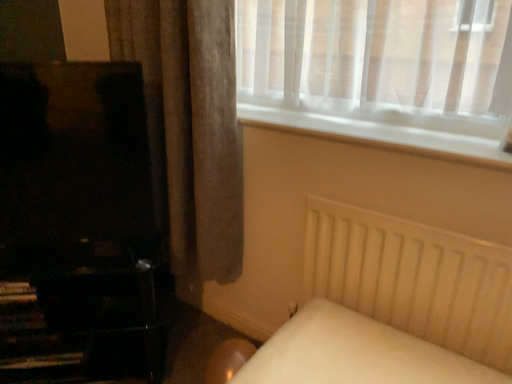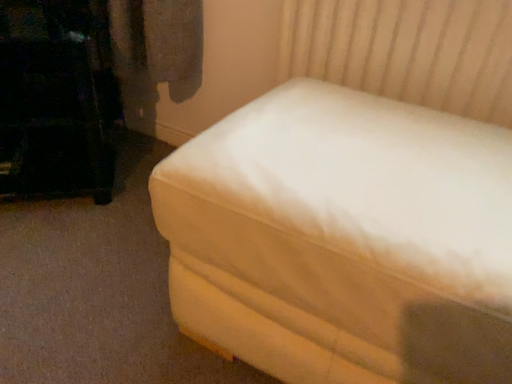
Question: Which way did the camera rotate in the video?

Choices:
 (A) rotated left
 (B) rotated right

Answer: (B)